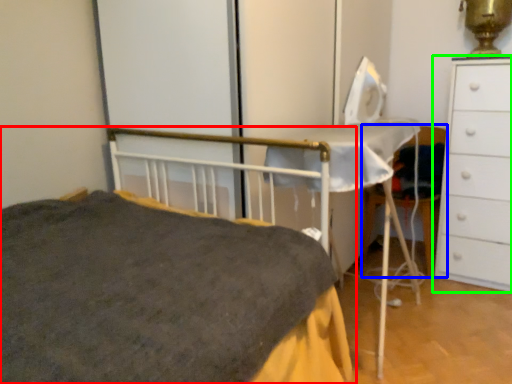
Question: Based on their relative distances, which object is nearer to bed (highlighted by a red box)? Choose from chair (highlighted by a blue box) and chest of drawers (highlighted by a green box).

Choices:
 (A) chair
 (B) chest of drawers

Answer: (B)